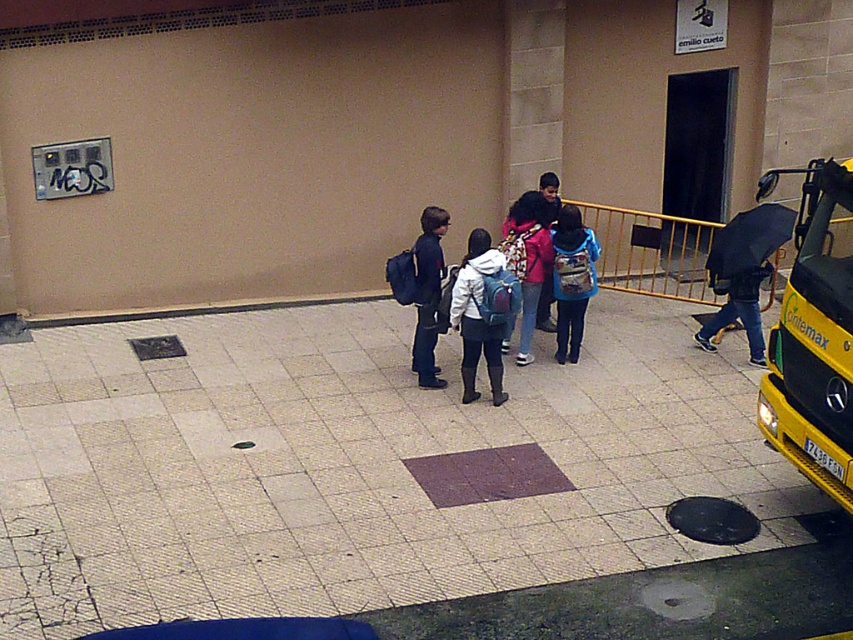
Question: Does yellow metallic bus at right have a larger size compared to matte black backpack at center?

Choices:
 (A) no
 (B) yes

Answer: (B)

Question: Which point is closer to the camera?

Choices:
 (A) (556, 260)
 (B) (421, 371)

Answer: (A)

Question: Does matte blue backpack at center appear under matte black backpack at center?

Choices:
 (A) no
 (B) yes

Answer: (B)

Question: Is blue backpack at center below matte black backpack at center?

Choices:
 (A) no
 (B) yes

Answer: (A)

Question: Which point appears farthest from the camera in this image?

Choices:
 (A) (556, 316)
 (B) (469, 284)

Answer: (A)

Question: Which object appears farthest from the camera in this image?

Choices:
 (A) matte black backpack at center
 (B) blue backpack at center
 (C) yellow metallic bus at right
 (D) matte blue backpack at center

Answer: (B)